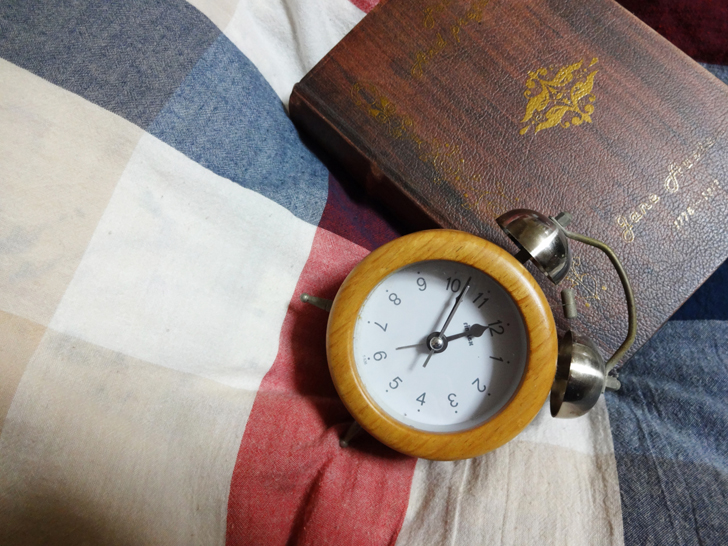
Identify the location of clock minute hand. (451, 317).